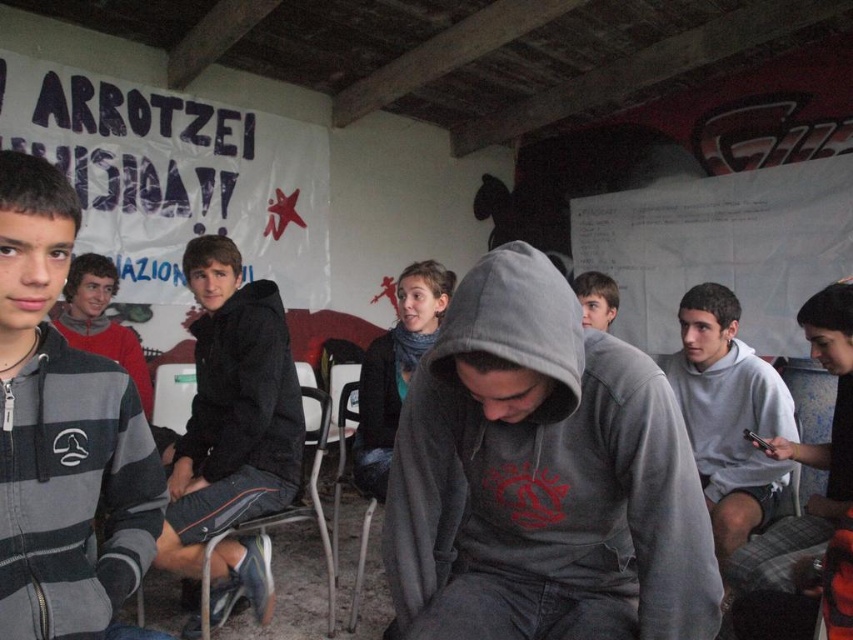
From the picture: You are a photographer trying to capture a candid shot of both the gray matte hoodie at center and the black matte jacket at center. Since you can only focus on one subject at a time, which one should you focus on to ensure the other is still somewhat in the frame?

You should focus on the gray matte hoodie at center because it is in front of the black matte jacket at center, so keeping the gray matte hoodie at center in focus will naturally keep the black matte jacket at center within the frame as well.

You are a photographer setting up for a group photo. You notice two items at the center of the scene, a black matte jacket and a black matte sweatshirt. Which one is taller between the black matte jacket at center and the black matte sweatshirt at center?

The black matte jacket at center is much taller as the black matte sweatshirt at center, so the black matte jacket at center is taller.

You are attending a meeting in this room and notice two items at the center. Which item is positioned higher up, the gray matte hoodie at center or the black matte jacket at center?

The gray matte hoodie at center is positioned higher up than the black matte jacket at center according to the description.